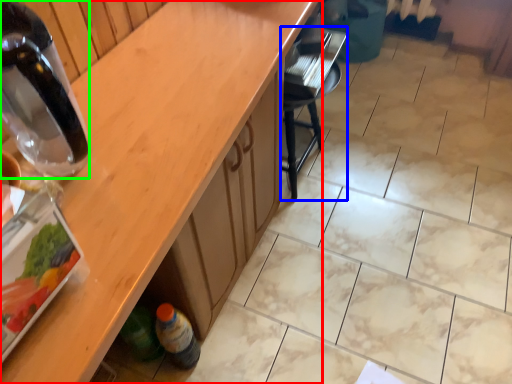
Question: Which object is the farthest from countertop (highlighted by a red box)? Choose among these: chair (highlighted by a blue box) or bottle (highlighted by a green box).

Choices:
 (A) chair
 (B) bottle

Answer: (A)